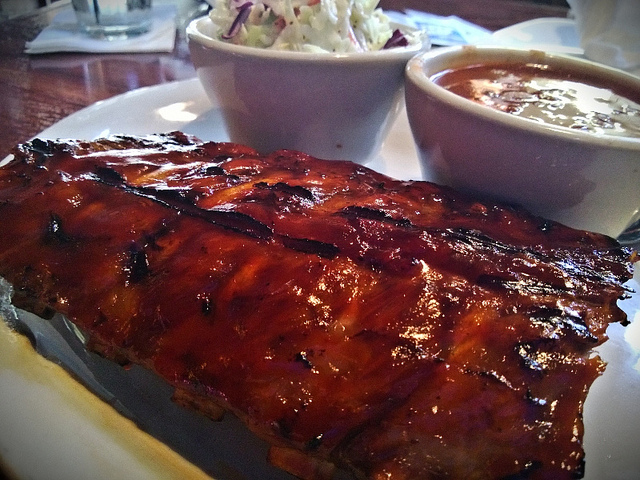
Identify the location of ramekin. This screenshot has height=480, width=640. (280, 99), (520, 155).